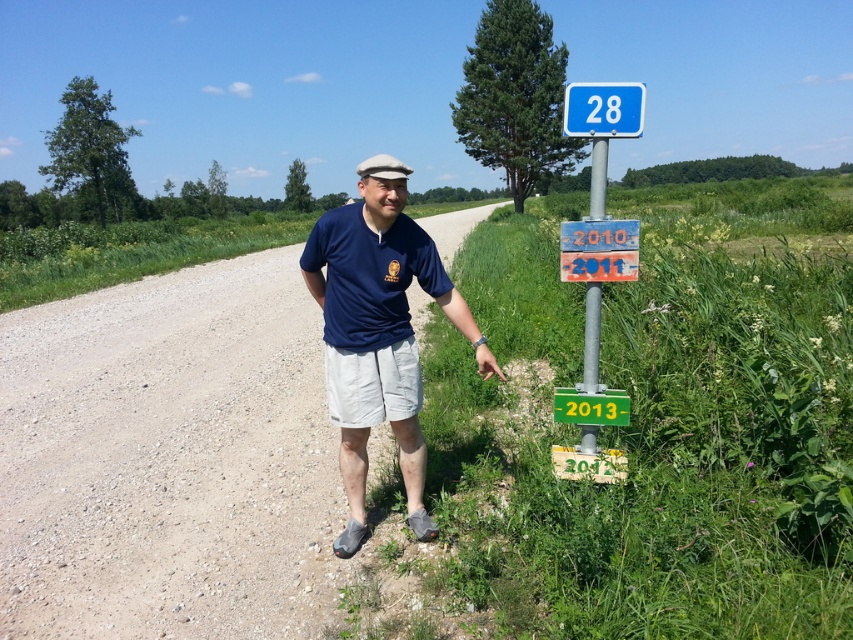
Question: Which object is the closest to the blue plastic sign at upper center?

Choices:
 (A) metallic pole at right
 (B) white matte baseball hat at upper center
 (C) navy blue t-shirt at center
 (D) blue plastic sign at upper right

Answer: (D)

Question: Can you confirm if blue plastic sign at upper center is positioned to the left of metallic pole at right?

Choices:
 (A) no
 (B) yes

Answer: (B)

Question: Is navy blue t-shirt at center smaller than white matte baseball hat at upper center?

Choices:
 (A) no
 (B) yes

Answer: (B)

Question: Where is blue plastic sign at upper center located in relation to metallic pole at right in the image?

Choices:
 (A) left
 (B) right

Answer: (A)

Question: Among these points, which one is farthest from the camera?

Choices:
 (A) (608, 90)
 (B) (405, 177)

Answer: (B)

Question: Which of the following is the closest to the observer?

Choices:
 (A) (363, 460)
 (B) (404, 164)

Answer: (B)